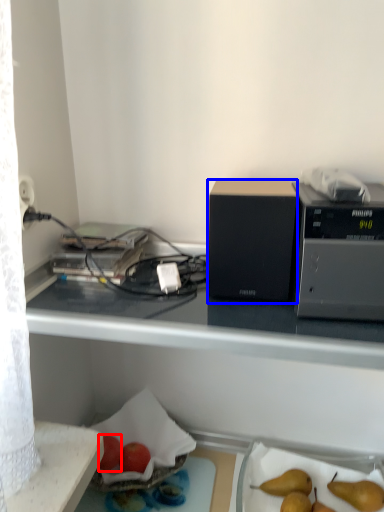
Question: Which of the following is the closest to the observer, apple (highlighted by a red box) or appliance (highlighted by a blue box)?

Choices:
 (A) apple
 (B) appliance

Answer: (B)